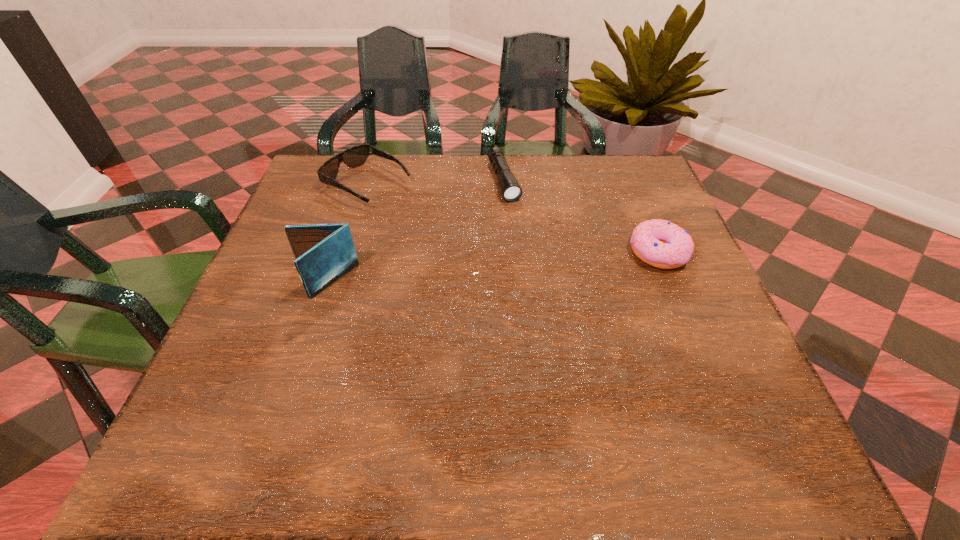
Image resolution: width=960 pixels, height=540 pixels. Identify the location of vacant spot on the desktop that is between the tallest object and the rightmost object and is positioned on the front-facing side of the sunglasses. (526, 264).

Find the location of `free space on the desktop that is between the wallet and the doughnut and is positioned at the lens end of the flashlight`. free space on the desktop that is between the wallet and the doughnut and is positioned at the lens end of the flashlight is located at coordinates (540, 262).